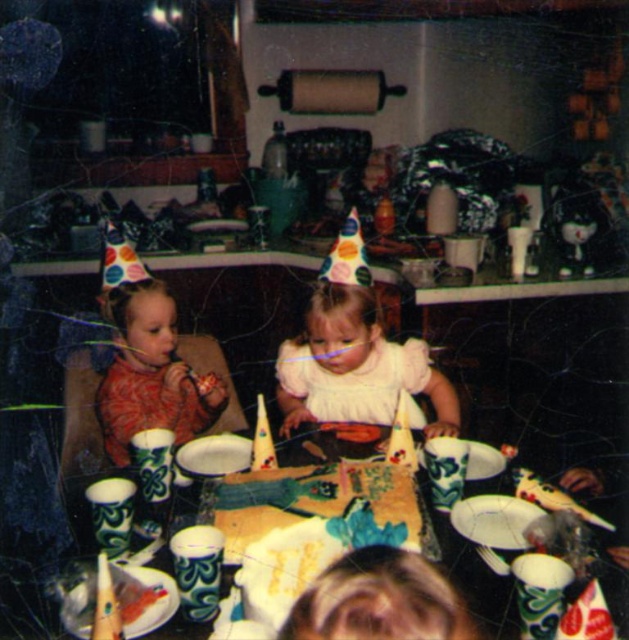
You are a photographer standing 6 feet away from the table where the white satin dress at center is placed. Can you reach the dress without moving your feet?

The white satin dress at center is 5.15 feet away from the viewer. Since you are standing 6 feet away from the table, the dress is slightly closer than your position, so you can reach it without moving your feet.

There are two children at a birthday party table. The child in the matte red dress at left and the other child in the white dress at right. If the distance between them is 5.53 feet, can a 6 feet long birthday cake be placed between them so that both can reach it easily?

The distance between the matte red dress at left and the white dress at right is 5.53 feet. A 6 feet long birthday cake would be longer than the space between them, so it cannot be placed between them without overlapping either child.

Based on the photo, you are a photographer who wants to ensure both the white satin dress at center and the matte red dress at left are visible in a new photo. Given their sizes, which dress should you focus on to include both in the frame without cropping?

The white satin dress at center is bigger than the matte red dress at left, so you should focus on the white satin dress at center to ensure both are visible in the frame without cropping.